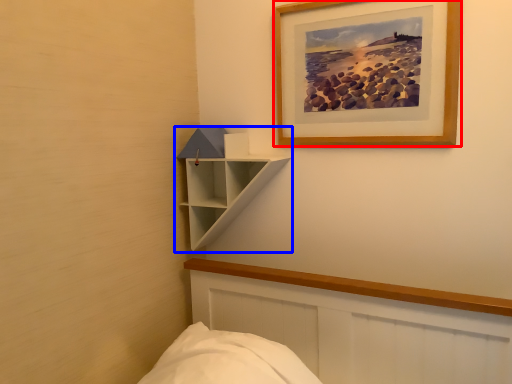
Question: Which object appears closest to the camera in this image, picture frame (highlighted by a red box) or shelf (highlighted by a blue box)?

Choices:
 (A) picture frame
 (B) shelf

Answer: (A)